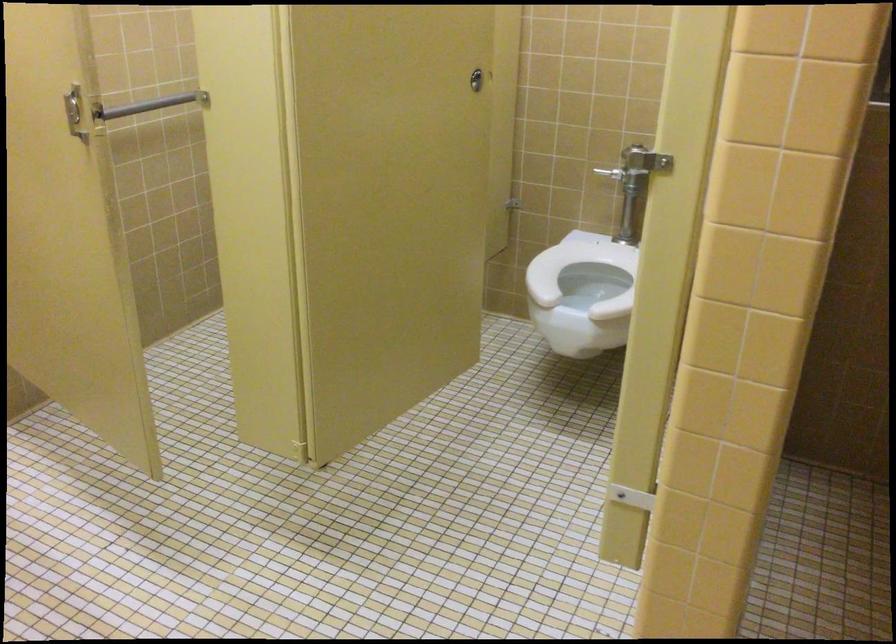
This screenshot has width=896, height=644. Find the location of `stall door lock`. stall door lock is located at coordinates (74, 111).